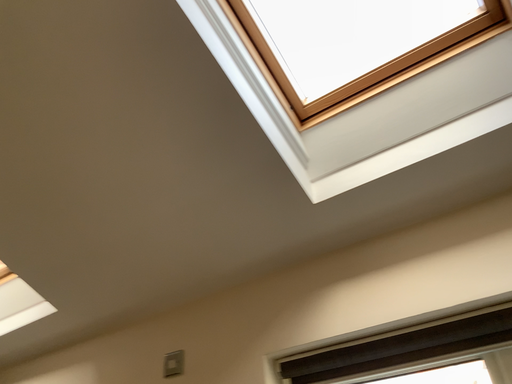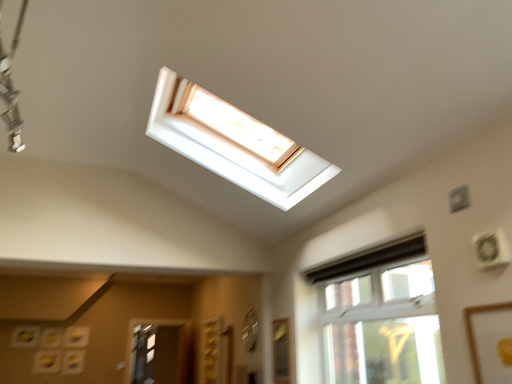
Question: How did the camera likely rotate when shooting the video?

Choices:
 (A) rotated downward
 (B) rotated upward

Answer: (A)